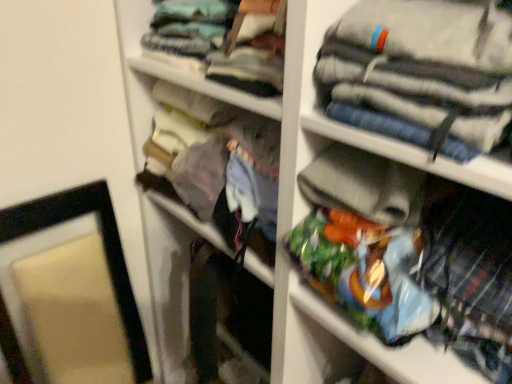
The width and height of the screenshot is (512, 384). I want to click on plaid fabric shirt at lower right, positioned as the 1th clothing in bottom-to-top order, so click(470, 273).

How much space does plaid fabric shirt at lower right, positioned as the 1th clothing in bottom-to-top order, occupy horizontally?

It is 22.84 centimeters.

What is the approximate height of matte fabric purse at center?

matte fabric purse at center is 10.27 inches in height.

Image resolution: width=512 pixels, height=384 pixels. I want to click on matte black picture frame at left, so click(x=104, y=247).

From a real-world perspective, is matte fabric purse at center on light blue fabric at upper center, which is the 3th clothing in bottom-to-top order?

No, from a real-world perspective, matte fabric purse at center is not on top of light blue fabric at upper center, which is the 3th clothing in bottom-to-top order.

In terms of size, does matte fabric purse at center appear bigger or smaller than light blue fabric at upper center, which is the 3th clothing in bottom-to-top order?

Considering their sizes, matte fabric purse at center takes up more space than light blue fabric at upper center, which is the 3th clothing in bottom-to-top order.

This screenshot has width=512, height=384. What are the coordinates of `the 1st clothing to the right of the matte fabric purse at center, starting your count from the anchor` in the screenshot? It's located at (213, 46).

Is matte fabric purse at center positioned beyond the bounds of light blue fabric at upper center, which is the 1th clothing in top-to-bottom order?

Absolutely, matte fabric purse at center is external to light blue fabric at upper center, which is the 1th clothing in top-to-bottom order.

Which object is more forward, striped cotton pants at upper right, acting as the second clothing starting from the bottom, or matte fabric purse at center?

Positioned in front is striped cotton pants at upper right, acting as the second clothing starting from the bottom.

The width and height of the screenshot is (512, 384). Find the location of `cabinet beneath the striped cotton pants at upper right, acting as the second clothing starting from the bottom (from a real-world perspective)`. cabinet beneath the striped cotton pants at upper right, acting as the second clothing starting from the bottom (from a real-world perspective) is located at coordinates (203, 85).

Is the surface of striped cotton pants at upper right, the second clothing when ordered from top to bottom, in direct contact with matte fabric purse at center?

No, striped cotton pants at upper right, the second clothing when ordered from top to bottom, is not in contact with matte fabric purse at center.

Is striped cotton pants at upper right, acting as the second clothing starting from the bottom, oriented towards matte fabric purse at center?

No, striped cotton pants at upper right, acting as the second clothing starting from the bottom, is not oriented towards matte fabric purse at center.

From the image's perspective, which one is positioned lower, striped cotton pants at upper right, the second clothing when ordered from top to bottom, or matte black picture frame at left?

matte black picture frame at left, from the image's perspective.

Is striped cotton pants at upper right, acting as the second clothing starting from the bottom, inside the boundaries of matte black picture frame at left, or outside?

striped cotton pants at upper right, acting as the second clothing starting from the bottom, lies outside matte black picture frame at left.

Can you confirm if striped cotton pants at upper right, the second clothing when ordered from top to bottom, is shorter than matte black picture frame at left?

Correct, striped cotton pants at upper right, the second clothing when ordered from top to bottom, is not as tall as matte black picture frame at left.

Considering the relative sizes of striped cotton pants at upper right, the second clothing when ordered from top to bottom, and matte black picture frame at left in the image provided, is striped cotton pants at upper right, the second clothing when ordered from top to bottom, wider than matte black picture frame at left?

No, striped cotton pants at upper right, the second clothing when ordered from top to bottom, is not wider than matte black picture frame at left.

This screenshot has height=384, width=512. Find the location of `the 2nd clothing to the right of the matte black picture frame at left, starting your count from the anchor`. the 2nd clothing to the right of the matte black picture frame at left, starting your count from the anchor is located at coordinates (425, 68).

Is matte black picture frame at left in front of striped cotton pants at upper right, the second clothing when ordered from top to bottom?

No, it is not.

Are matte black picture frame at left and striped cotton pants at upper right, acting as the second clothing starting from the bottom, far apart?

matte black picture frame at left is near striped cotton pants at upper right, acting as the second clothing starting from the bottom, not far away.

Considering the sizes of objects matte fabric purse at center and striped cotton pants at upper right, acting as the second clothing starting from the bottom, in the image provided, who is wider, matte fabric purse at center or striped cotton pants at upper right, acting as the second clothing starting from the bottom,?

matte fabric purse at center.

Can you confirm if matte fabric purse at center is bigger than striped cotton pants at upper right, acting as the second clothing starting from the bottom?

Yes, matte fabric purse at center is bigger than striped cotton pants at upper right, acting as the second clothing starting from the bottom.

Is point (490, 285) closer to camera compared to point (187, 216)?

Yes.

Locate an element on the screen. cabinet above the plaid fabric shirt at lower right, positioned as the 1th clothing in bottom-to-top order (from the image's perspective) is located at coordinates (203, 85).

From a real-world perspective, is plaid fabric shirt at lower right, which is the 3th clothing in top-to-bottom order, physically located above or below matte fabric purse at center?

In terms of real-world spatial position, plaid fabric shirt at lower right, which is the 3th clothing in top-to-bottom order, is above matte fabric purse at center.

Can you confirm if plaid fabric shirt at lower right, positioned as the 1th clothing in bottom-to-top order, is smaller than matte fabric purse at center?

Yes, plaid fabric shirt at lower right, positioned as the 1th clothing in bottom-to-top order, is smaller than matte fabric purse at center.

Considering the relative positions of light blue fabric at upper center, which is the 3th clothing in bottom-to-top order, and matte fabric purse at center in the image provided, is light blue fabric at upper center, which is the 3th clothing in bottom-to-top order, to the right of matte fabric purse at center from the viewer's perspective?

Correct, you'll find light blue fabric at upper center, which is the 3th clothing in bottom-to-top order, to the right of matte fabric purse at center.

How far apart are light blue fabric at upper center, which is the 1th clothing in top-to-bottom order, and matte fabric purse at center?

light blue fabric at upper center, which is the 1th clothing in top-to-bottom order, and matte fabric purse at center are 2.29 inches apart from each other.

How different are the orientations of light blue fabric at upper center, which is the 1th clothing in top-to-bottom order, and matte fabric purse at center in degrees?

The angular difference between light blue fabric at upper center, which is the 1th clothing in top-to-bottom order, and matte fabric purse at center is 2.75 degrees.

Could you tell me if light blue fabric at upper center, which is the 3th clothing in bottom-to-top order, is facing matte fabric purse at center?

No, light blue fabric at upper center, which is the 3th clothing in bottom-to-top order, is not facing towards matte fabric purse at center.

Locate an element on the screen. cabinet located on the left of light blue fabric at upper center, which is the 1th clothing in top-to-bottom order is located at coordinates pyautogui.click(x=203, y=85).

Where is `clothing that is the 3rd object located in front of the matte fabric purse at center`? The image size is (512, 384). clothing that is the 3rd object located in front of the matte fabric purse at center is located at coordinates (425, 68).

Based on their spatial positions, is striped cotton pants at upper right, acting as the second clothing starting from the bottom, or plaid fabric shirt at lower right, positioned as the 1th clothing in bottom-to-top order, closer to matte black picture frame at left?

striped cotton pants at upper right, acting as the second clothing starting from the bottom.

Estimate the real-world distances between objects in this image. Which object is further from light blue fabric at upper center, which is the 1th clothing in top-to-bottom order, matte fabric purse at center or matte black picture frame at left?

matte black picture frame at left is positioned further to the anchor light blue fabric at upper center, which is the 1th clothing in top-to-bottom order.

Looking at this image, looking at the image, which one is located further to matte fabric purse at center, striped cotton pants at upper right, acting as the second clothing starting from the bottom, or plaid fabric shirt at lower right, positioned as the 1th clothing in bottom-to-top order?

Based on the image, plaid fabric shirt at lower right, positioned as the 1th clothing in bottom-to-top order, appears to be further to matte fabric purse at center.

Estimate the real-world distances between objects in this image. Which object is closer to light blue fabric at upper center, which is the 1th clothing in top-to-bottom order, matte fabric purse at center or striped cotton pants at upper right, the second clothing when ordered from top to bottom?

Among the two, matte fabric purse at center is located nearer to light blue fabric at upper center, which is the 1th clothing in top-to-bottom order.

Which object lies nearer to the anchor point striped cotton pants at upper right, the second clothing when ordered from top to bottom, light blue fabric at upper center, which is the 1th clothing in top-to-bottom order, or matte fabric purse at center?

Based on the image, matte fabric purse at center appears to be nearer to striped cotton pants at upper right, the second clothing when ordered from top to bottom.

Considering their positions, is plaid fabric shirt at lower right, which is the 3th clothing in top-to-bottom order, positioned closer to matte fabric purse at center than light blue fabric at upper center, which is the 1th clothing in top-to-bottom order?

light blue fabric at upper center, which is the 1th clothing in top-to-bottom order.

Which object lies further to the anchor point matte fabric purse at center, light blue fabric at upper center, which is the 1th clothing in top-to-bottom order, or matte black picture frame at left?

matte black picture frame at left is further to matte fabric purse at center.

In the scene shown: Which object lies nearer to the anchor point matte black picture frame at left, light blue fabric at upper center, which is the 3th clothing in bottom-to-top order, or striped cotton pants at upper right, acting as the second clothing starting from the bottom?

The object closer to matte black picture frame at left is light blue fabric at upper center, which is the 3th clothing in bottom-to-top order.

At what (x,y) coordinates should I click in order to perform the action: click on clothing that lies between light blue fabric at upper center, which is the 1th clothing in top-to-bottom order, and plaid fabric shirt at lower right, positioned as the 1th clothing in bottom-to-top order, from top to bottom. Please return your answer as a coordinate pair (x, y). Looking at the image, I should click on (425, 68).

Find the location of a particular element. cabinet between striped cotton pants at upper right, the second clothing when ordered from top to bottom, and matte black picture frame at left vertically is located at coordinates (203, 85).

At what (x,y) coordinates should I click in order to perform the action: click on cabinet located between matte black picture frame at left and plaid fabric shirt at lower right, positioned as the 1th clothing in bottom-to-top order, in the left-right direction. Please return your answer as a coordinate pair (x, y). Looking at the image, I should click on (203, 85).

Locate an element on the screen. This screenshot has height=384, width=512. cabinet between light blue fabric at upper center, which is the 1th clothing in top-to-bottom order, and matte black picture frame at left, in the vertical direction is located at coordinates (203, 85).